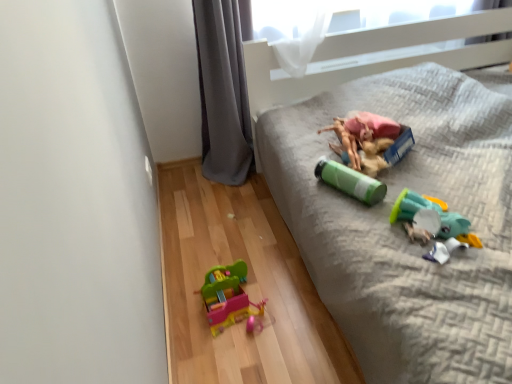
Where is `vacant area that is in front of gray fabric curtain at lower left`? The height and width of the screenshot is (384, 512). vacant area that is in front of gray fabric curtain at lower left is located at coordinates (228, 202).